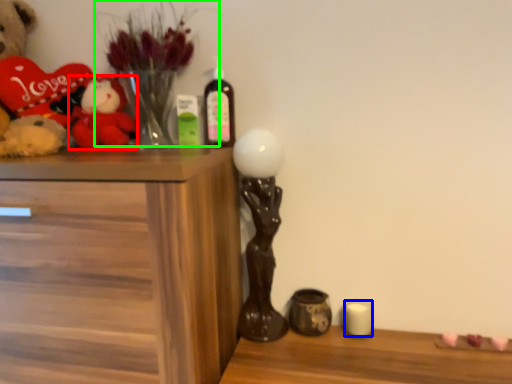
Question: Considering the real-world distances, which object is closest to toy (highlighted by a red box)? candle (highlighted by a blue box) or floral arrangement (highlighted by a green box).

Choices:
 (A) candle
 (B) floral arrangement

Answer: (B)